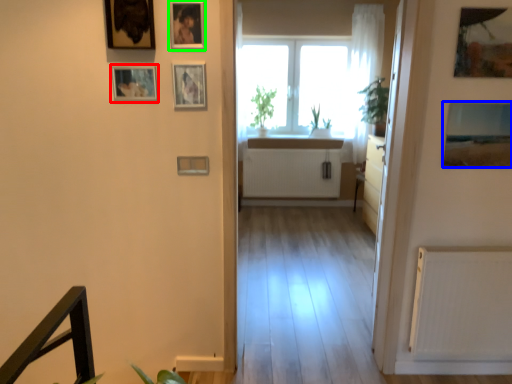
Question: Which object is positioned farthest from picture frame (highlighted by a red box)? Select from picture frame (highlighted by a blue box) and picture frame (highlighted by a green box).

Choices:
 (A) picture frame
 (B) picture frame

Answer: (A)